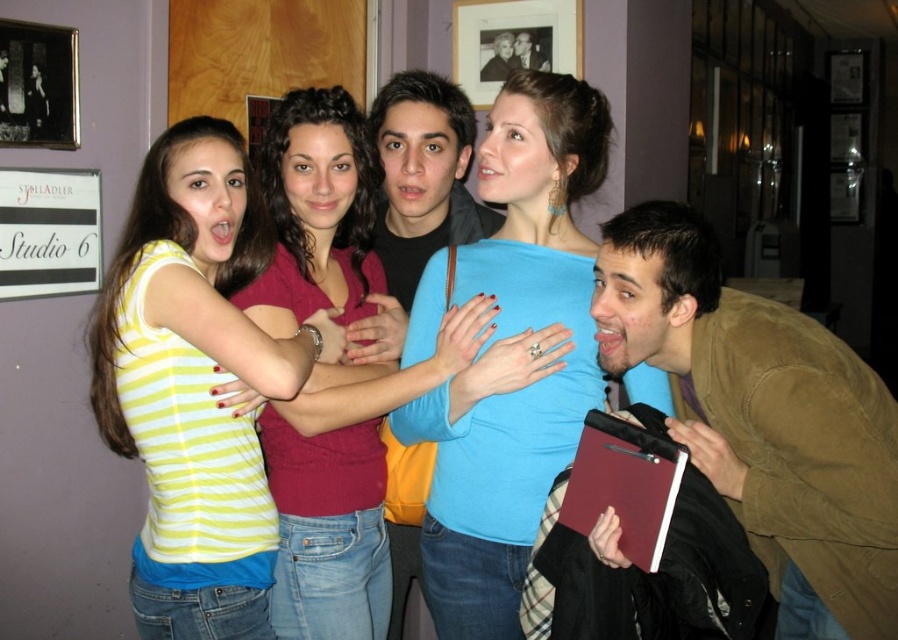
You are taking a photo of a group of friends and want to focus on two specific points in the image. The first point is at coordinates point (x=403, y=205) and the second is at point (x=508, y=36). Which of these two points is closer to the camera?

Point (x=403, y=205) is closer to the camera than point (x=508, y=36).

You are standing at the point marked as point (850, 637) in the image. If you want to greet someone who is 5 feet away from you, can you reach them without moving?

The distance between you and the viewer is 4.94 feet, so yes, you can reach them without moving since the distance is slightly less than 5 feet.

You are standing in front of the group and want to hand a gift to the person wearing the blue matte shirt at center and the matte black shirt at center. Since you can only reach one of them, which one can you reach without moving closer?

The blue matte shirt at center is closer to the viewer than the matte black shirt at center, so you can reach the person wearing the blue matte shirt at center without moving closer.